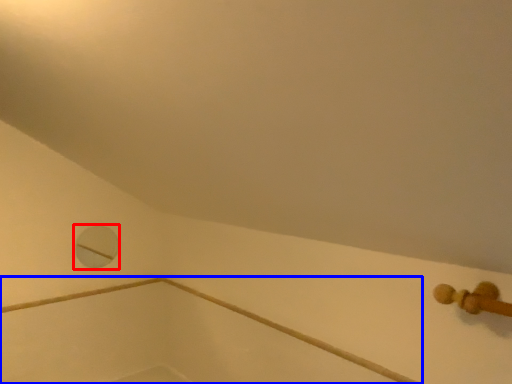
Question: Which object is closer to the camera taking this photo, hole (highlighted by a red box) or bath (highlighted by a blue box)?

Choices:
 (A) hole
 (B) bath

Answer: (B)